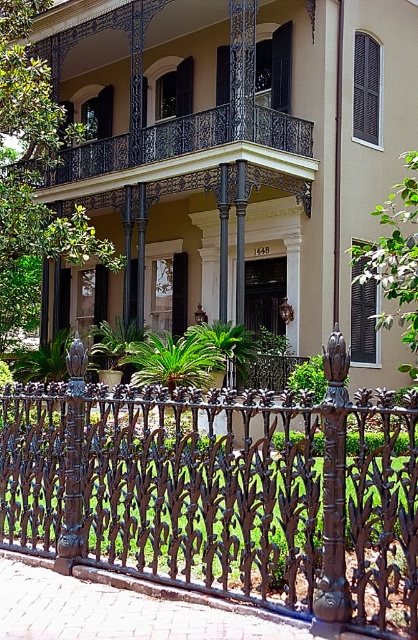
Does black wrought iron balcony at upper center appear on the left side of polished bronze post at center?

Yes, black wrought iron balcony at upper center is to the left of polished bronze post at center.

Who is more forward, (135, 120) or (338, 531)?

Positioned in front is point (338, 531).

Which is behind, point (224, 161) or point (339, 541)?

The point (224, 161) is more distant.

Image resolution: width=418 pixels, height=640 pixels. I want to click on black wrought iron balcony at upper center, so click(183, 106).

Is black wrought iron fence at lower center wider than polished bronze post at center?

Yes.

Describe the element at coordinates (222, 493) in the screenshot. This screenshot has width=418, height=640. I see `black wrought iron fence at lower center` at that location.

Describe the element at coordinates (222, 493) in the screenshot. I see `black wrought iron fence at lower center` at that location.

Locate an element on the screen. black wrought iron fence at lower center is located at coordinates (222, 493).

Is black wrought iron fence at lower center closer to the viewer compared to black wrought iron balcony at upper center?

That is True.

Does black wrought iron fence at lower center have a smaller size compared to black wrought iron balcony at upper center?

Yes.

Locate an element on the screen. Image resolution: width=418 pixels, height=640 pixels. black wrought iron fence at lower center is located at coordinates [x=222, y=493].